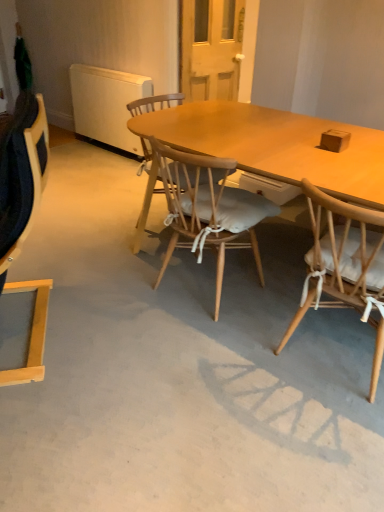
Where is `vacant region to the left of wooden chair with cushion at center, acting as the second chair starting from the right`? vacant region to the left of wooden chair with cushion at center, acting as the second chair starting from the right is located at coordinates (119, 284).